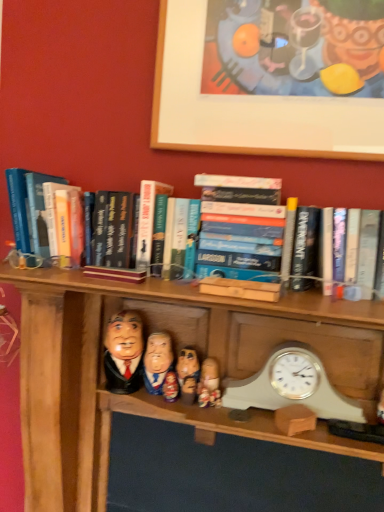
Question: Is wooden picture frame at upper center closer to camera compared to white plastic clock at lower right?

Choices:
 (A) yes
 (B) no

Answer: (B)

Question: Is wooden picture frame at upper center at the right side of white plastic clock at lower right?

Choices:
 (A) no
 (B) yes

Answer: (A)

Question: Is wooden picture frame at upper center oriented away from white plastic clock at lower right?

Choices:
 (A) yes
 (B) no

Answer: (B)

Question: Could you tell me if wooden picture frame at upper center is facing white plastic clock at lower right?

Choices:
 (A) no
 (B) yes

Answer: (A)

Question: Are wooden picture frame at upper center and white plastic clock at lower right located far from each other?

Choices:
 (A) yes
 (B) no

Answer: (B)

Question: Does wooden picture frame at upper center have a larger size compared to white plastic clock at lower right?

Choices:
 (A) yes
 (B) no

Answer: (A)

Question: From a real-world perspective, is hardcover book at center under wooden doll at center, which is the 3th toy in right-to-left order?

Choices:
 (A) no
 (B) yes

Answer: (A)

Question: Is hardcover book at center beside wooden doll at center, arranged as the first toy when viewed from the left?

Choices:
 (A) no
 (B) yes

Answer: (A)

Question: Considering the relative sizes of hardcover book at center and wooden doll at center, arranged as the first toy when viewed from the left, in the image provided, is hardcover book at center smaller than wooden doll at center, arranged as the first toy when viewed from the left,?

Choices:
 (A) no
 (B) yes

Answer: (A)

Question: From the image's perspective, is hardcover book at center above wooden doll at center, which is the 3th toy in right-to-left order?

Choices:
 (A) no
 (B) yes

Answer: (B)

Question: Does hardcover book at center appear on the left side of wooden doll at center, arranged as the first toy when viewed from the left?

Choices:
 (A) no
 (B) yes

Answer: (A)

Question: Considering the relative positions of hardcover book at center and wooden doll at center, which is the 3th toy in right-to-left order, in the image provided, is hardcover book at center to the right of wooden doll at center, which is the 3th toy in right-to-left order, from the viewer's perspective?

Choices:
 (A) yes
 (B) no

Answer: (A)

Question: From the image's perspective, is wooden figurine at center, acting as the fourth person starting from the left, located above wooden figurine at center, the second person positioned from the left?

Choices:
 (A) no
 (B) yes

Answer: (A)